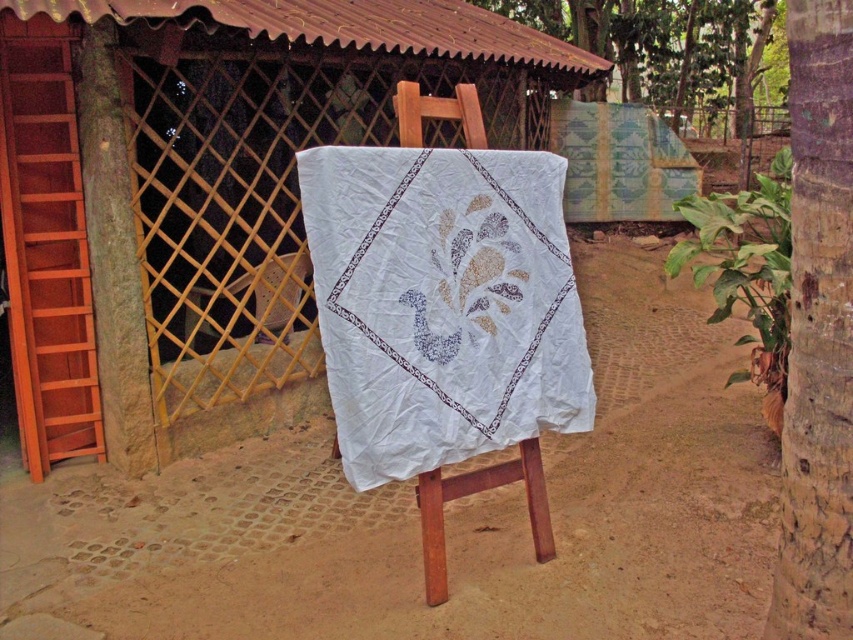
Identify the location of dirt field at center. The height and width of the screenshot is (640, 853). (445, 516).

In order to click on dirt field at center in this screenshot , I will do `click(445, 516)`.

How far apart are brown rough bark tree at right and wooden stool at center?

brown rough bark tree at right and wooden stool at center are 1.23 meters apart.

Is brown rough bark tree at right bigger than wooden stool at center?

Yes.

This screenshot has height=640, width=853. What do you see at coordinates (817, 333) in the screenshot?
I see `brown rough bark tree at right` at bounding box center [817, 333].

Where is `brown rough bark tree at right`? brown rough bark tree at right is located at coordinates (817, 333).

Who is more distant from viewer, (650, 26) or (434, 589)?

Positioned behind is point (650, 26).

Between green leafy tree at upper right and wooden stool at center, which one has less height?

wooden stool at center is shorter.

Which is in front, point (701, 92) or point (535, 460)?

Positioned in front is point (535, 460).

At what (x,y) coordinates should I click in order to perform the action: click on green leafy tree at upper right. Please return your answer as a coordinate pair (x, y). Image resolution: width=853 pixels, height=640 pixels. Looking at the image, I should click on (672, 51).